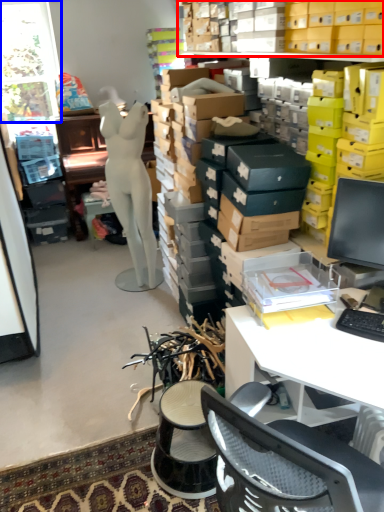
Question: Which of the following is the closest to the observer, shelf (highlighted by a red box) or window (highlighted by a blue box)?

Choices:
 (A) shelf
 (B) window

Answer: (A)